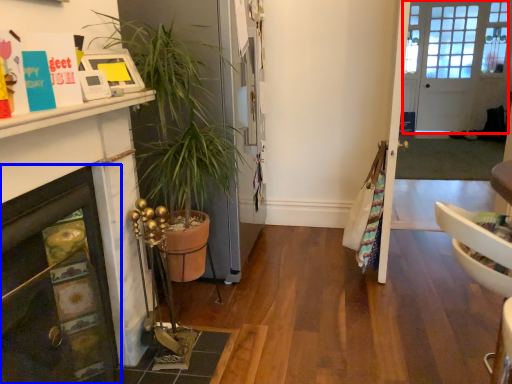
Question: Among these objects, which one is farthest to the camera, door (highlighted by a red box) or fireplace (highlighted by a blue box)?

Choices:
 (A) door
 (B) fireplace

Answer: (A)